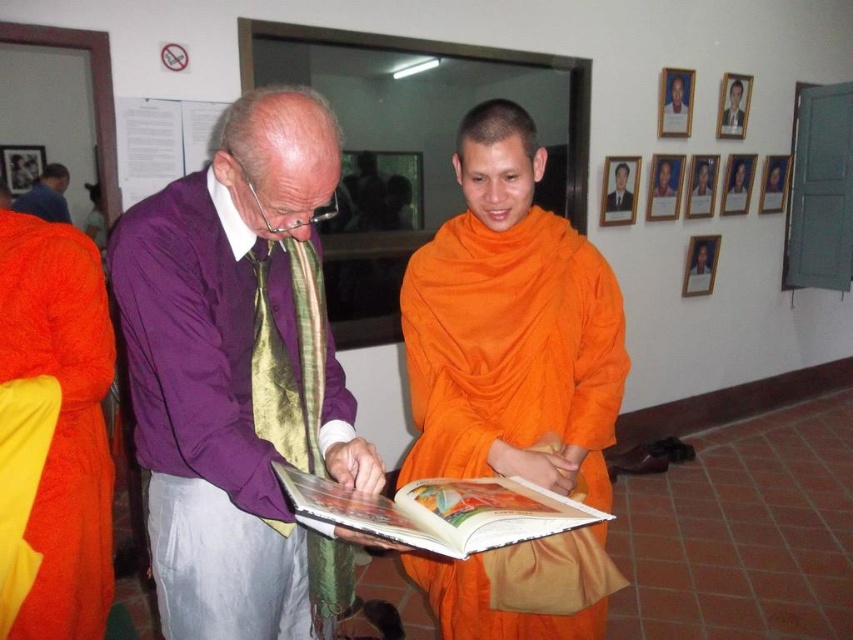
You are organizing a bookshelf and need to place the orange cloth book at center and the purple silk tie at center side by side. Based on their widths, which one should be placed on the left to ensure they fit properly?

The orange cloth book at center might be wider than purple silk tie at center, so placing the wider orange cloth book at center on the left would ensure they fit properly.

You are an observer standing in front of the scene. You see the purple silk shirt at center and the orange silk robe at left. Which one is positioned more to the right side?

The purple silk shirt at center is positioned more to the right side than the orange silk robe at left.

You are standing in the temple and want to place a new book on the shelf. The shelf is located at point (439, 512). Can you place the book there?

The orange cloth book at center is already located at point (439, 512), so you cannot place the new book there.